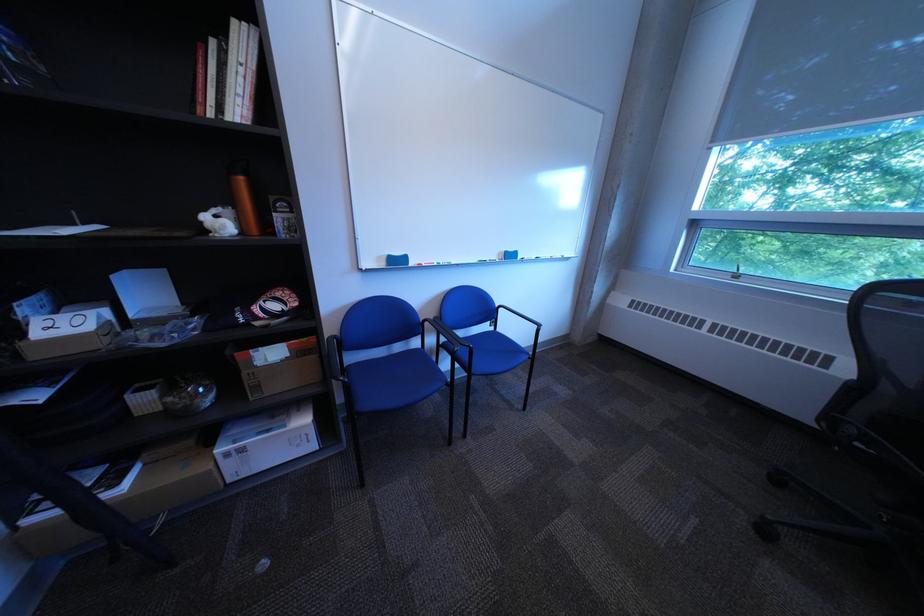
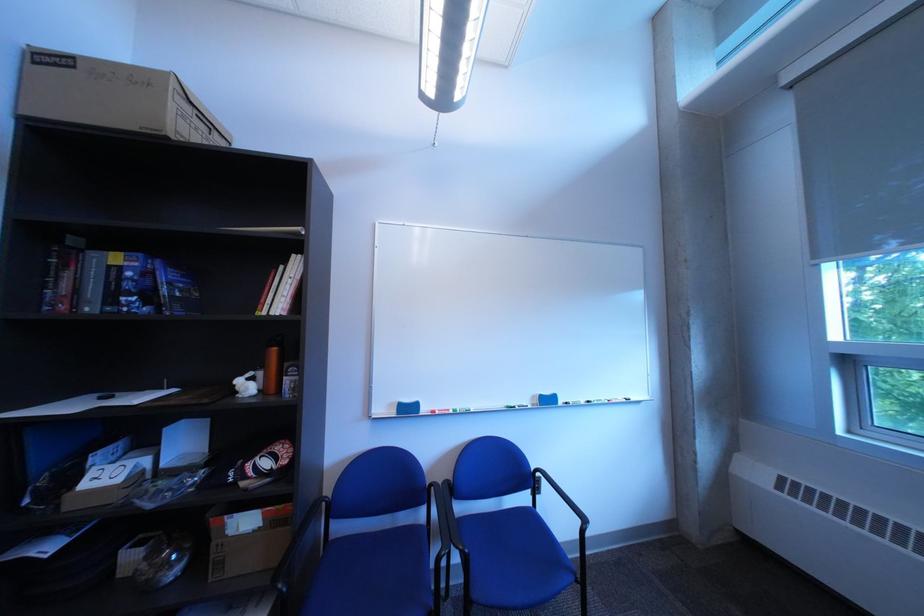
Locate, in the second image, the point that corresponds to (x=274, y=387) in the first image.

(237, 565)